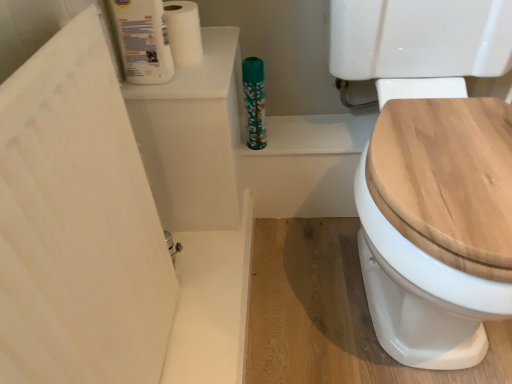
Question: Should I look upward or downward to see wooden toilet seat at right?

Choices:
 (A) up
 (B) down

Answer: (A)

Question: Can you confirm if white matte toilet paper at upper left, the first toilet paper in the back-to-front sequence, is bigger than teal floral-patterned bottle at upper center?

Choices:
 (A) no
 (B) yes

Answer: (B)

Question: From a real-world perspective, is white matte toilet paper at upper left, the first toilet paper in the back-to-front sequence, physically below teal floral-patterned bottle at upper center?

Choices:
 (A) yes
 (B) no

Answer: (B)

Question: Does white matte toilet paper at upper left, positioned as the second toilet paper in front-to-back order, turn towards teal floral-patterned bottle at upper center?

Choices:
 (A) yes
 (B) no

Answer: (B)

Question: From the image's perspective, does white matte toilet paper at upper left, positioned as the second toilet paper in front-to-back order, appear higher than teal floral-patterned bottle at upper center?

Choices:
 (A) no
 (B) yes

Answer: (B)

Question: Can you see white matte toilet paper at upper left, the first toilet paper in the back-to-front sequence, touching teal floral-patterned bottle at upper center?

Choices:
 (A) yes
 (B) no

Answer: (B)

Question: Considering the relative sizes of white matte toilet paper at upper left, the first toilet paper in the back-to-front sequence, and teal floral-patterned bottle at upper center in the image provided, is white matte toilet paper at upper left, the first toilet paper in the back-to-front sequence, wider than teal floral-patterned bottle at upper center?

Choices:
 (A) no
 (B) yes

Answer: (B)

Question: Does teal floral-patterned bottle at upper center have a larger size compared to white glossy toilet paper at upper left, the first toilet paper in the front-to-back sequence?

Choices:
 (A) yes
 (B) no

Answer: (B)

Question: Would you consider teal floral-patterned bottle at upper center to be distant from white glossy toilet paper at upper left, the first toilet paper in the front-to-back sequence?

Choices:
 (A) no
 (B) yes

Answer: (A)

Question: Is teal floral-patterned bottle at upper center smaller than white glossy toilet paper at upper left, placed as the second toilet paper when sorted from back to front?

Choices:
 (A) yes
 (B) no

Answer: (A)

Question: Is teal floral-patterned bottle at upper center to the left of white glossy toilet paper at upper left, placed as the second toilet paper when sorted from back to front, from the viewer's perspective?

Choices:
 (A) yes
 (B) no

Answer: (B)

Question: Can you confirm if teal floral-patterned bottle at upper center is wider than white glossy toilet paper at upper left, the first toilet paper in the front-to-back sequence?

Choices:
 (A) no
 (B) yes

Answer: (A)

Question: Is teal floral-patterned bottle at upper center at the right side of white glossy toilet paper at upper left, placed as the second toilet paper when sorted from back to front?

Choices:
 (A) yes
 (B) no

Answer: (A)

Question: Is white glossy toilet paper at upper left, placed as the second toilet paper when sorted from back to front, facing away from wooden toilet seat at right?

Choices:
 (A) no
 (B) yes

Answer: (A)